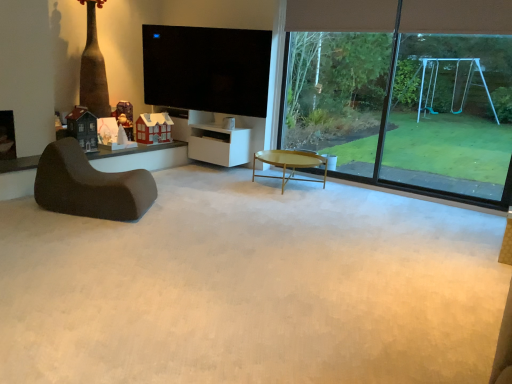
Question: Does matte black house at left, the 3th toy viewed from the right, touch transparent glass swing set at right?

Choices:
 (A) yes
 (B) no

Answer: (B)

Question: Is matte black house at left, the third toy when ordered from back to front, oriented towards transparent glass swing set at right?

Choices:
 (A) no
 (B) yes

Answer: (A)

Question: Does matte black house at left, marked as the first toy in a front-to-back arrangement, have a smaller size compared to transparent glass swing set at right?

Choices:
 (A) yes
 (B) no

Answer: (A)

Question: Is matte black house at left, which is the first toy from left to right, further to camera compared to transparent glass swing set at right?

Choices:
 (A) yes
 (B) no

Answer: (A)

Question: From a real-world perspective, does matte black house at left, which is the first toy from left to right, sit lower than transparent glass swing set at right?

Choices:
 (A) no
 (B) yes

Answer: (B)

Question: Choose the correct answer: Is white matte cabinet at center inside wooden santa at center, placed as the 2th toy when sorted from left to right, or outside it?

Choices:
 (A) outside
 (B) inside

Answer: (A)

Question: Is white matte cabinet at center to the left or to the right of wooden santa at center, acting as the first toy starting from the back, in the image?

Choices:
 (A) right
 (B) left

Answer: (A)

Question: From a real-world perspective, is white matte cabinet at center positioned above or below wooden santa at center, arranged as the 3th toy when viewed from the front?

Choices:
 (A) above
 (B) below

Answer: (B)

Question: Considering the positions of white matte cabinet at center and wooden santa at center, the second toy viewed from the right, in the image, is white matte cabinet at center bigger or smaller than wooden santa at center, the second toy viewed from the right,?

Choices:
 (A) big
 (B) small

Answer: (A)

Question: Looking at their shapes, would you say white matte cabinet at center is wider or thinner than white paper house at center, marked as the first toy in a right-to-left arrangement?

Choices:
 (A) wide
 (B) thin

Answer: (A)

Question: Considering the relative positions of white matte cabinet at center and white paper house at center, the second toy positioned from the front, in the image provided, is white matte cabinet at center to the left or to the right of white paper house at center, the second toy positioned from the front,?

Choices:
 (A) right
 (B) left

Answer: (A)

Question: Considering their positions, is white matte cabinet at center located in front of or behind white paper house at center, marked as the first toy in a right-to-left arrangement?

Choices:
 (A) front
 (B) behind

Answer: (B)

Question: Is point (227, 135) closer or farther from the camera than point (145, 114)?

Choices:
 (A) closer
 (B) farther

Answer: (A)

Question: Choose the correct answer: Is white matte cabinet at center inside dark brown fabric chair at left or outside it?

Choices:
 (A) inside
 (B) outside

Answer: (B)

Question: Is white matte cabinet at center to the left or to the right of dark brown fabric chair at left in the image?

Choices:
 (A) left
 (B) right

Answer: (B)